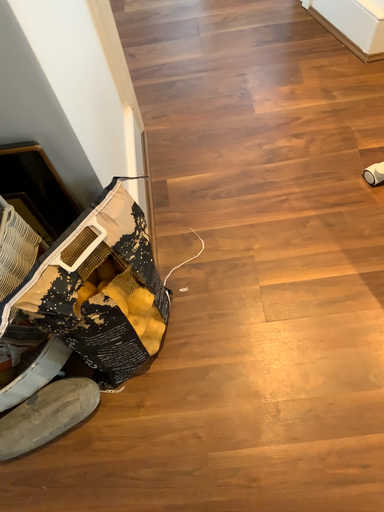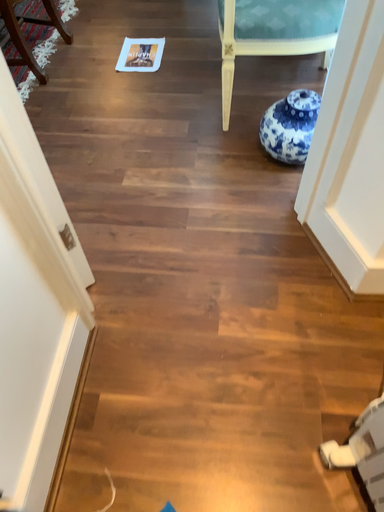
Question: How did the camera likely rotate when shooting the video?

Choices:
 (A) rotated downward
 (B) rotated upward

Answer: (B)